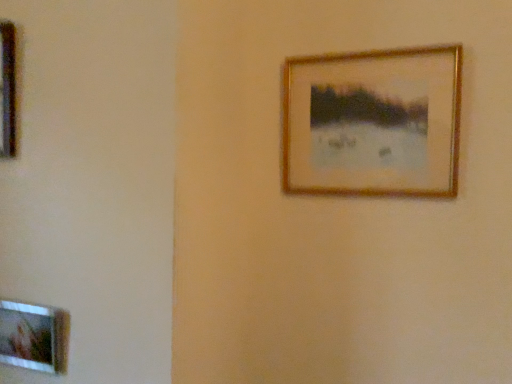
Question: Considering the positions of metallic gold picture frame at left, the 3th picture frame viewed from the right, and wooden picture frame at lower left, which ranks as the 2th picture frame in right-to-left order, in the image, is metallic gold picture frame at left, the 3th picture frame viewed from the right, wider or thinner than wooden picture frame at lower left, which ranks as the 2th picture frame in right-to-left order,?

Choices:
 (A) thin
 (B) wide

Answer: (B)

Question: Would you say metallic gold picture frame at left, arranged as the first picture frame when viewed from the top, is to the left or to the right of wooden picture frame at lower left, arranged as the third picture frame when viewed from the top, in the picture?

Choices:
 (A) right
 (B) left

Answer: (B)

Question: Estimate the real-world distances between objects in this image. Which object is farther from the metallic gold picture frame at left, arranged as the first picture frame when viewed from the top?

Choices:
 (A) gold metallic picture frame at upper right, which appears as the 2th picture frame when ordered from the bottom
 (B) wooden picture frame at lower left, marked as the second picture frame in a left-to-right arrangement

Answer: (A)

Question: Estimate the real-world distances between objects in this image. Which object is closer to the wooden picture frame at lower left, arranged as the third picture frame when viewed from the top?

Choices:
 (A) gold metallic picture frame at upper right, which appears as the first picture frame when viewed from the right
 (B) metallic gold picture frame at left, arranged as the first picture frame when viewed from the top

Answer: (B)